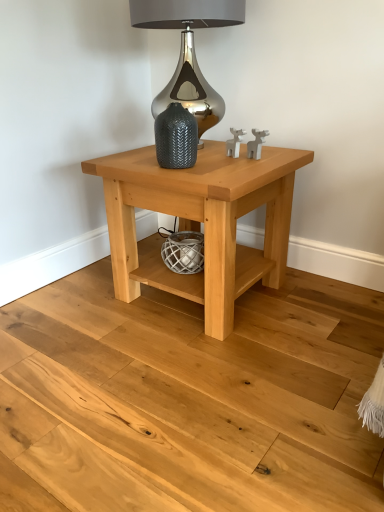
Where is `blank space above natural wood floor at lower center (from a real-world perspective)`? This screenshot has height=512, width=384. blank space above natural wood floor at lower center (from a real-world perspective) is located at coordinates (150, 382).